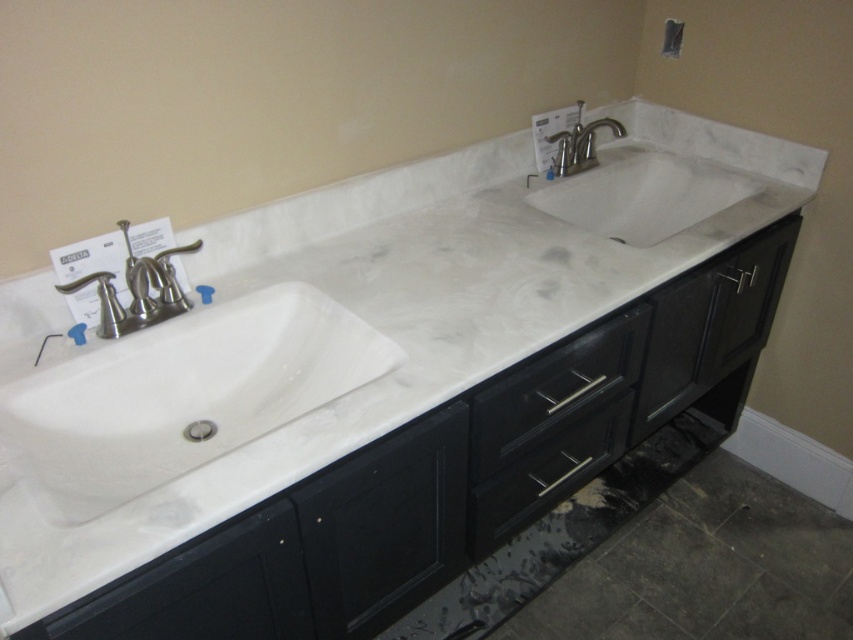
You are standing in front of the bathroom vanity and need to place a small decorative item on the countertop. You have two options for placement based on coordinates given as points. The first point is at position (233, 448) and the second is at (627, 196). Which point is closer to you when viewed from the front?

Point (233, 448) is closer to you because it is in front of point (627, 196) when viewed from the front.

You are standing in front of the bathroom vanity and want to place a small decorative item. There are two points marked on the countertop at coordinates point (142,448) and point (592,156). Which point is closer to you, and therefore a better spot for the item to be easily seen?

Point (142,448) is closer to the viewer than point (592,156), so placing the decorative item there would make it more visible.